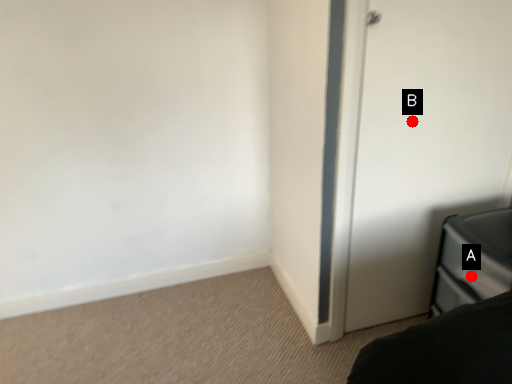
Question: Two points are circled on the image, labeled by A and B beside each circle. Which point appears farthest from the camera in this image?

Choices:
 (A) A is further
 (B) B is further

Answer: (B)